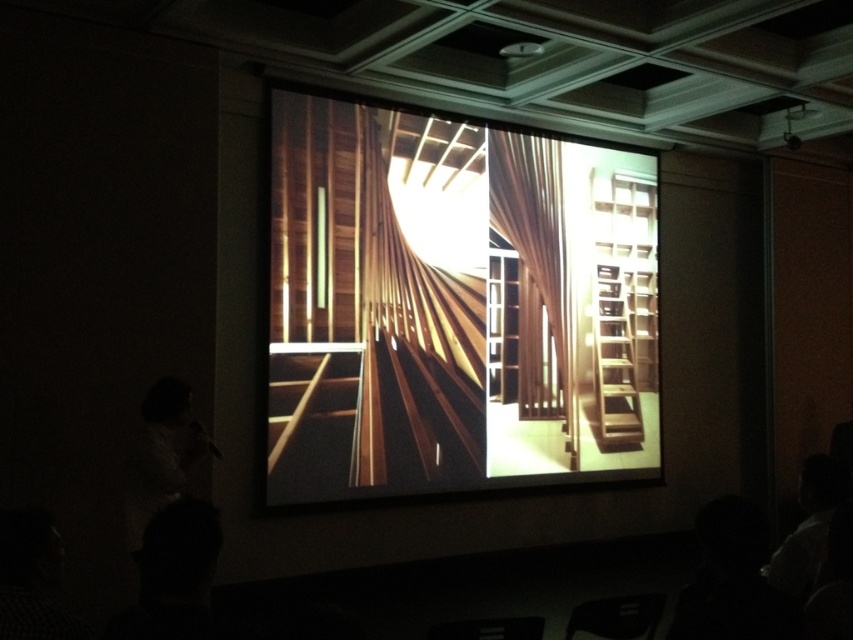
Question: From the image, what is the correct spatial relationship of wooden stairs at center in relation to wooden slats at center?

Choices:
 (A) below
 (B) above

Answer: (A)

Question: Which object is closer to the camera taking this photo?

Choices:
 (A) wooden slats at center
 (B) wooden at center

Answer: (A)

Question: Can you confirm if wooden slats at center is positioned above wooden at center?

Choices:
 (A) no
 (B) yes

Answer: (B)

Question: Among these points, which one is farthest from the camera?

Choices:
 (A) (329, 465)
 (B) (512, 164)

Answer: (B)

Question: Does wooden slats at center have a greater width compared to wooden at center?

Choices:
 (A) yes
 (B) no

Answer: (A)

Question: Which point is farther to the camera?

Choices:
 (A) (490, 129)
 (B) (276, 99)
 (C) (445, 474)

Answer: (A)